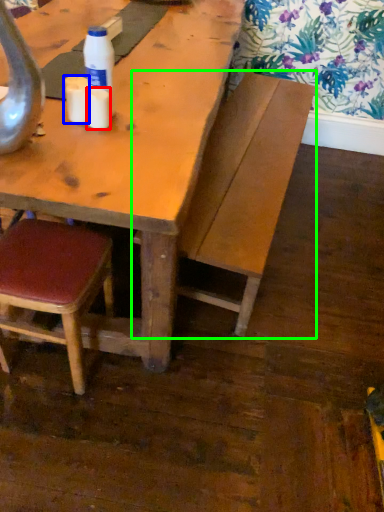
Question: Based on their relative distances, which object is farther from coffee cup (highlighted by a red box)? Choose from coffee cup (highlighted by a blue box) and bench (highlighted by a green box).

Choices:
 (A) coffee cup
 (B) bench

Answer: (B)